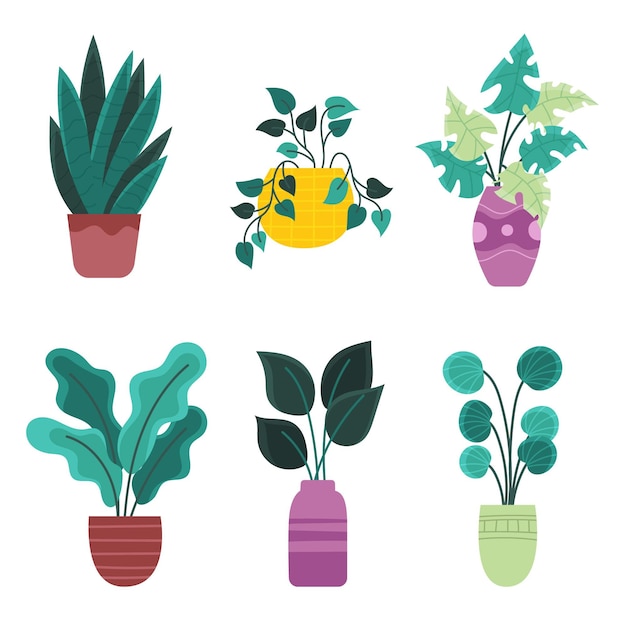
You are a GUI agent. You are given a task and a screenshot of the screen. Output one action in this format:
    pyautogui.click(x=<x>, y=<y>)
    Task: Click on the vase openings
    This screenshot has height=626, width=626.
    Given the screenshot: What is the action you would take?
    pyautogui.click(x=317, y=484), pyautogui.click(x=118, y=516), pyautogui.click(x=515, y=505), pyautogui.click(x=500, y=188), pyautogui.click(x=317, y=168), pyautogui.click(x=106, y=216)